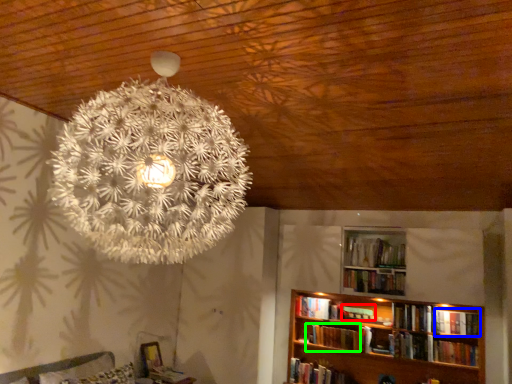
Question: Which is farther away from book (highlighted by a red box)? book (highlighted by a blue box) or book (highlighted by a green box)?

Choices:
 (A) book
 (B) book

Answer: (A)